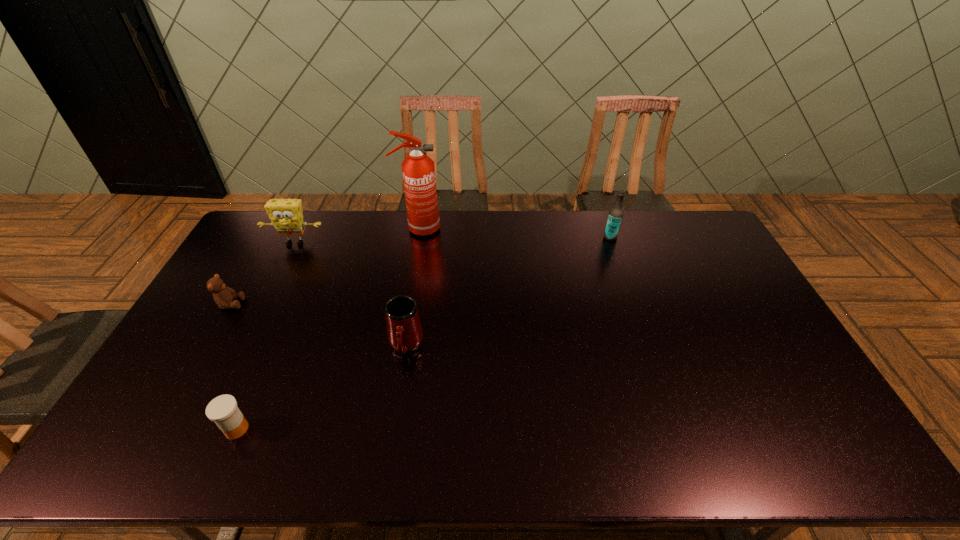
Image resolution: width=960 pixels, height=540 pixels. Identify the location of the tallest object. (418, 170).

Locate an element on the screen. The height and width of the screenshot is (540, 960). beer bottle is located at coordinates (615, 216).

This screenshot has height=540, width=960. Find the location of `sponge`. sponge is located at coordinates (286, 215).

This screenshot has height=540, width=960. Identify the location of the fourth tallest object. (404, 331).

You are a GUI agent. You are given a task and a screenshot of the screen. Output one action in this format:
    pyautogui.click(x=<x>, y=<y>)
    Task: Click on the mug
    Image resolution: width=960 pixels, height=540 pixels.
    Given the screenshot: What is the action you would take?
    pyautogui.click(x=404, y=331)

Locate an element on the screen. The image size is (960, 540). the fourth farthest object is located at coordinates (223, 296).

Find the location of a particular element. the nearest object is located at coordinates (223, 410).

You are a GUI agent. You are given a task and a screenshot of the screen. Output one action in this format:
    pyautogui.click(x=<x>, y=<y>)
    Task: Click on the vacant area located 0.070m at the nozzle of the tallest object
    
    Given the screenshot: What is the action you would take?
    pyautogui.click(x=458, y=229)

The image size is (960, 540). I want to click on vacant space located 0.370m on the label of the beer bottle, so click(x=506, y=237).

Where is `vacant space located 0.170m on the label of the beer bottle`? vacant space located 0.170m on the label of the beer bottle is located at coordinates (559, 237).